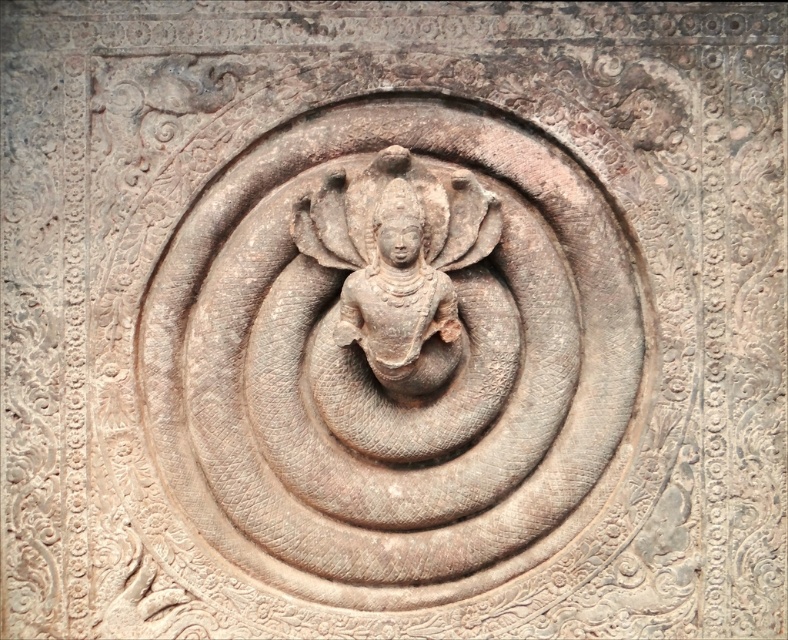
The width and height of the screenshot is (788, 640). What do you see at coordinates (391, 353) in the screenshot?
I see `rustic stone carving at center` at bounding box center [391, 353].

Can you confirm if rustic stone carving at center is wider than rustic stone deity at center?

Yes.

You are a GUI agent. You are given a task and a screenshot of the screen. Output one action in this format:
    pyautogui.click(x=<x>, y=<y>)
    Task: Click on the rustic stone carving at center
    
    Given the screenshot: What is the action you would take?
    pyautogui.click(x=391, y=353)

Locate an element on the screen. The image size is (788, 640). rustic stone carving at center is located at coordinates (391, 353).